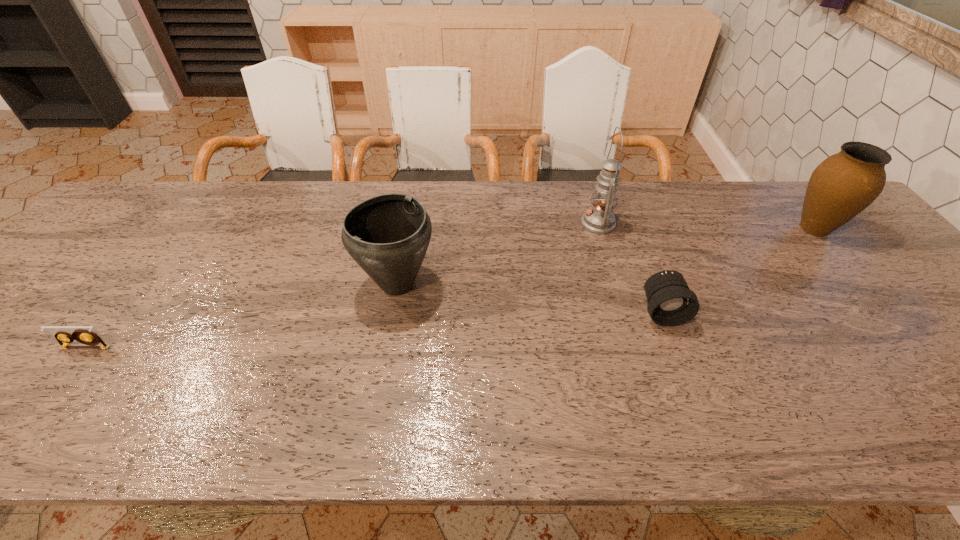
This screenshot has height=540, width=960. I want to click on free space at the right edge of the desktop, so click(948, 398).

This screenshot has width=960, height=540. What are the coordinates of `free space at the far left corner of the desktop` in the screenshot? It's located at [104, 224].

The image size is (960, 540). I want to click on vacant space in between the videotape and the rightmost object, so click(450, 288).

You are a GUI agent. You are given a task and a screenshot of the screen. Output one action in this format:
    pyautogui.click(x=<x>, y=<y>)
    Task: Click on the free point between the farther urn and the fourth object from right to left
    
    Given the screenshot: What is the action you would take?
    pyautogui.click(x=606, y=256)

Where is `free space that is in between the nearest object and the telephoto lens`? The width and height of the screenshot is (960, 540). free space that is in between the nearest object and the telephoto lens is located at coordinates (374, 329).

The image size is (960, 540). I want to click on vacant area that lies between the tallest object and the nearer urn, so click(x=498, y=254).

The width and height of the screenshot is (960, 540). I want to click on vacant area that lies between the videotape and the left urn, so click(242, 316).

This screenshot has height=540, width=960. I want to click on free space between the telephoto lens and the left urn, so (x=530, y=298).

You are a GUI agent. You are given a task and a screenshot of the screen. Output one action in this format:
    pyautogui.click(x=<x>, y=<y>)
    Task: Click on the empty location between the nearer urn and the rightmost object
    The image size is (960, 540).
    Given the screenshot: What is the action you would take?
    (x=606, y=256)

I want to click on free spot between the telephoto lens and the farther urn, so click(738, 269).